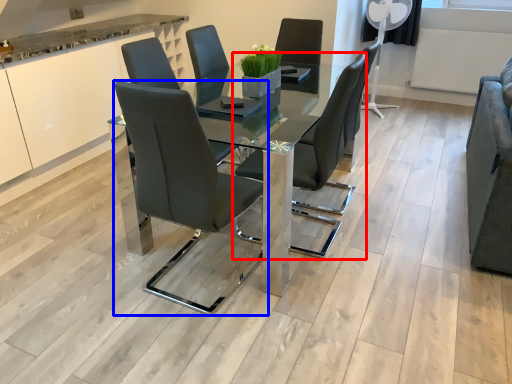
Question: Which point is closer to the camera, chair (highlighted by a red box) or chair (highlighted by a blue box)?

Choices:
 (A) chair
 (B) chair

Answer: (B)